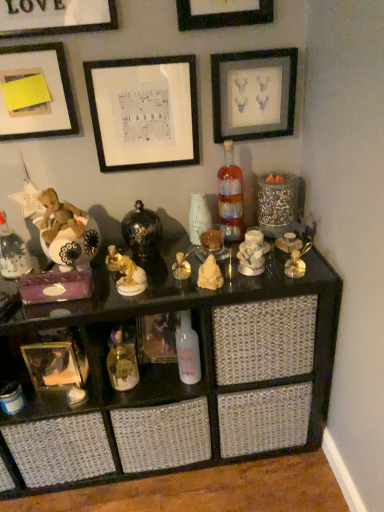
This screenshot has width=384, height=512. I want to click on free point to the right of porcelain figurine at center, the 1th toy when ordered from right to left, so click(303, 268).